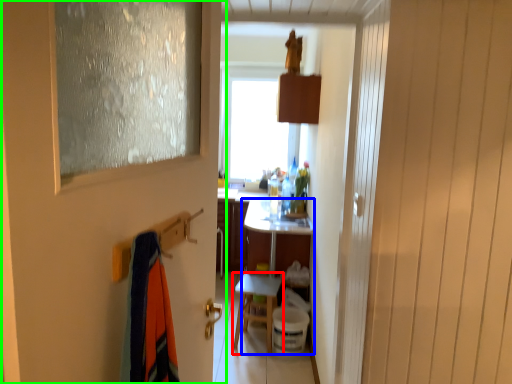
Question: Which object is the farthest from table (highlighted by a red box)? Choose among these: vanity (highlighted by a blue box) or door (highlighted by a green box).

Choices:
 (A) vanity
 (B) door

Answer: (B)